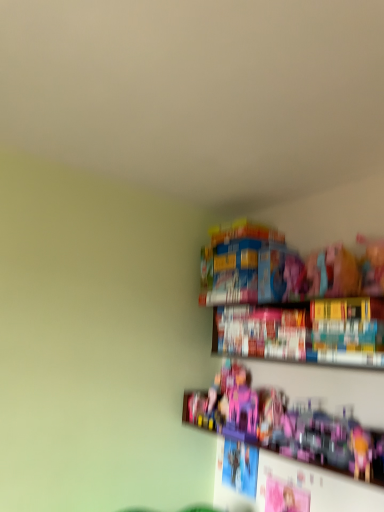
Question: Is hardcover book at upper right positioned before pink plastic toy at lower right, placed as the 1th toy when sorted from right to left?

Choices:
 (A) no
 (B) yes

Answer: (A)

Question: Is hardcover book at upper right positioned far away from pink plastic toy at lower right, placed as the 1th toy when sorted from right to left?

Choices:
 (A) yes
 (B) no

Answer: (B)

Question: Is hardcover book at upper right positioned with its back to pink plastic toy at lower right, arranged as the second toy when viewed from the left?

Choices:
 (A) yes
 (B) no

Answer: (B)

Question: Does hardcover book at upper right contain pink plastic toy at lower right, placed as the 1th toy when sorted from right to left?

Choices:
 (A) no
 (B) yes

Answer: (A)

Question: Does hardcover book at upper right have a lesser width compared to pink plastic toy at lower right, arranged as the second toy when viewed from the left?

Choices:
 (A) yes
 (B) no

Answer: (A)

Question: From a real-world perspective, is hardcover book at upper right under pink plastic toy at lower right, arranged as the second toy when viewed from the left?

Choices:
 (A) yes
 (B) no

Answer: (B)

Question: From the image's perspective, is pink plastic toy at lower right, placed as the 1th toy when sorted from right to left, on hardcover book at upper right?

Choices:
 (A) no
 (B) yes

Answer: (A)

Question: Does pink plastic toy at lower right, placed as the 1th toy when sorted from right to left, lie in front of hardcover book at upper right?

Choices:
 (A) no
 (B) yes

Answer: (B)

Question: Is pink plastic toy at lower right, arranged as the second toy when viewed from the left, not close to hardcover book at upper right?

Choices:
 (A) yes
 (B) no

Answer: (B)

Question: From the image's perspective, is pink plastic toy at lower right, arranged as the second toy when viewed from the left, beneath hardcover book at upper right?

Choices:
 (A) no
 (B) yes

Answer: (B)

Question: Is pink plastic toy at lower right, placed as the 1th toy when sorted from right to left, further to the viewer compared to hardcover book at upper right?

Choices:
 (A) no
 (B) yes

Answer: (A)

Question: Does pink plastic toy at lower right, placed as the 1th toy when sorted from right to left, have a smaller size compared to hardcover book at upper right?

Choices:
 (A) no
 (B) yes

Answer: (B)

Question: From a real-world perspective, is hardcover book at upper right on top of pink plastic castle at center, which is the 2th toy from right to left?

Choices:
 (A) no
 (B) yes

Answer: (B)